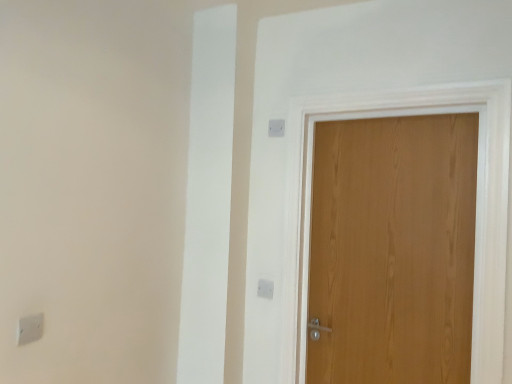
Question: Is white plastic light switch at upper center, the third light switch in the left-to-right sequence, positioned before white plastic light switch at lower left, marked as the 2th light switch in a bottom-to-top arrangement?

Choices:
 (A) no
 (B) yes

Answer: (A)

Question: Is white plastic light switch at upper center, the third light switch in the left-to-right sequence, thinner than white plastic light switch at lower left, which is counted as the 3th light switch, starting from the back?

Choices:
 (A) no
 (B) yes

Answer: (B)

Question: Can you confirm if white plastic light switch at upper center, which ranks as the 2th light switch in front-to-back order, is wider than white plastic light switch at lower left, the first light switch when ordered from front to back?

Choices:
 (A) yes
 (B) no

Answer: (B)

Question: From a real-world perspective, does white plastic light switch at upper center, which ranks as the 2th light switch in front-to-back order, stand above white plastic light switch at lower left, the first light switch when ordered from front to back?

Choices:
 (A) no
 (B) yes

Answer: (B)

Question: Is white plastic light switch at upper center, which is counted as the 1th light switch, starting from the right, turned away from white plastic light switch at lower left, the first light switch when ordered from front to back?

Choices:
 (A) yes
 (B) no

Answer: (B)

Question: Can you confirm if white plastic light switch at upper center, positioned as the second light switch in back-to-front order, is bigger than white plastic light switch at lower left, the 3th light switch from the right?

Choices:
 (A) yes
 (B) no

Answer: (B)

Question: Is white plastic light switch at upper center, which ranks as the 2th light switch in front-to-back order, closer to the viewer compared to white plastic light switch at upper center, the second light switch in the right-to-left sequence?

Choices:
 (A) no
 (B) yes

Answer: (B)

Question: Considering the relative sizes of white plastic light switch at upper center, which ranks as the 2th light switch in front-to-back order, and white plastic light switch at upper center, which is the 2th light switch in left-to-right order, in the image provided, is white plastic light switch at upper center, which ranks as the 2th light switch in front-to-back order, thinner than white plastic light switch at upper center, which is the 2th light switch in left-to-right order,?

Choices:
 (A) yes
 (B) no

Answer: (A)

Question: Does white plastic light switch at upper center, the third light switch in the left-to-right sequence, appear on the right side of white plastic light switch at upper center, which is the 2th light switch in left-to-right order?

Choices:
 (A) no
 (B) yes

Answer: (B)

Question: Is white plastic light switch at upper center, which ranks as the 2th light switch in front-to-back order, touching white plastic light switch at upper center, which is the 2th light switch in left-to-right order?

Choices:
 (A) no
 (B) yes

Answer: (A)

Question: Is white plastic light switch at upper center, which is counted as the 1th light switch, starting from the right, not close to white plastic light switch at upper center, the 3th light switch viewed from the front?

Choices:
 (A) yes
 (B) no

Answer: (B)

Question: Is white plastic light switch at upper center, which ranks as the 2th light switch in front-to-back order, oriented away from white plastic light switch at upper center, which is the 2th light switch in left-to-right order?

Choices:
 (A) yes
 (B) no

Answer: (B)

Question: From the image's perspective, is white plastic light switch at lower left, which is the 2th light switch from top to bottom, beneath white plastic light switch at upper center, the second light switch in the right-to-left sequence?

Choices:
 (A) no
 (B) yes

Answer: (A)